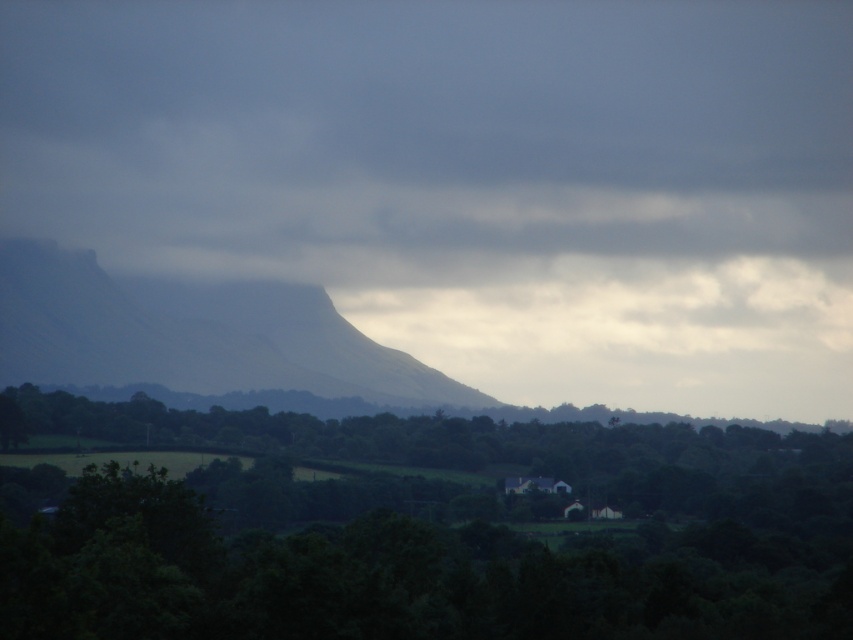
You are a hiker standing in the middle of the forest. You see a green leafy tree at center and a gray foggy mountain at center. Which object is closer to you?

The green leafy tree at center is closer to you because it is positioned in front of the gray foggy mountain at center.

Looking at this image, you are a hiker standing at the edge of the green leafy tree at center. You want to reach the top of the gray foggy mountain at center. Which direction should you move towards?

The gray foggy mountain at center is taller than the green leafy tree at center, so you should move towards the direction of the gray foggy mountain at center to reach its top.